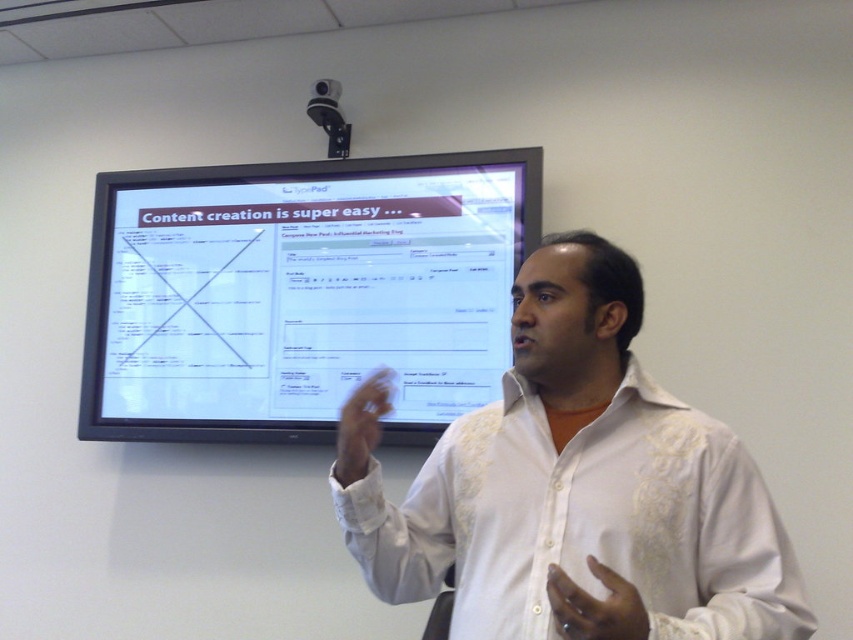
Is point (96, 321) positioned before point (374, 444)?

No.

Does point (403, 266) come farther from viewer compared to point (370, 429)?

Yes, it is behind point (370, 429).

Where is `matte black screen at upper center`? The width and height of the screenshot is (853, 640). matte black screen at upper center is located at coordinates (300, 292).

Between matte black screen at upper center and dark skin/hair at center, which one has more height?

Standing taller between the two is matte black screen at upper center.

Which is below, matte black screen at upper center or dark skin/hair at center?

dark skin/hair at center is below.

The image size is (853, 640). What are the coordinates of `matte black screen at upper center` in the screenshot? It's located at (300, 292).

Which is more to the left, matte black screen at upper center or white embroidered shirt at center?

matte black screen at upper center is more to the left.

Identify the location of matte black screen at upper center. This screenshot has height=640, width=853. (300, 292).

Measure the distance between matte black screen at upper center and camera.

matte black screen at upper center and camera are 7.34 feet apart from each other.

Where is `matte black screen at upper center`? The image size is (853, 640). matte black screen at upper center is located at coordinates (300, 292).